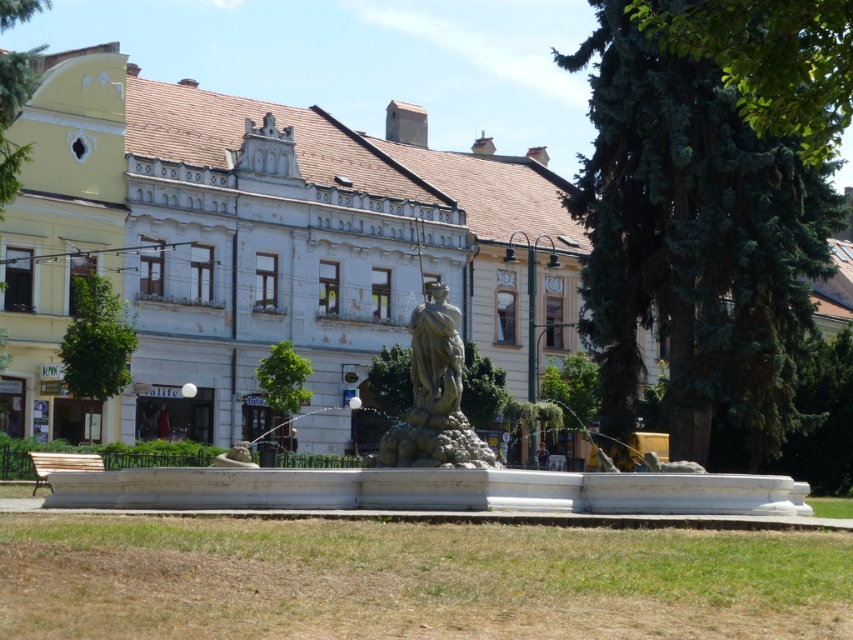
You are standing in the urban park scene and want to take a photo of the green leafy tree at upper right. If your camera has a maximum focus range of 120 feet, will you be able to capture the tree clearly?

The green leafy tree at upper right is 124.26 feet away from the viewer. Since the camera can only focus up to 120 feet, the tree is beyond the camera range and cannot be captured clearly.

You are standing at the camera position in the park and want to take a photo of the green leafy tree at left. The camera has a zoom range of 100 meters. Can you capture the tree in your photo without moving?

The green leafy tree at left is 81.87 meters from camera, which is within the camera zoom range of 100 meters. Therefore, you can capture the tree in your photo without moving.